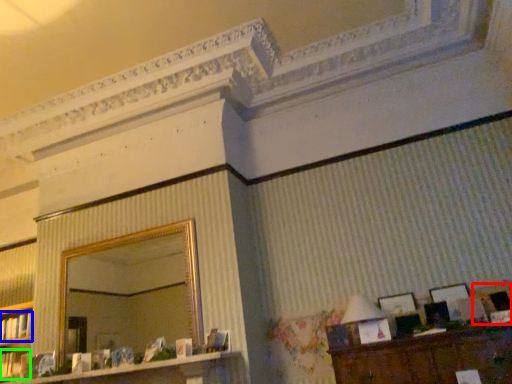
Question: Which object is the farthest from picture frame (highlighted by a red box)? Choose among these: book (highlighted by a blue box) or book (highlighted by a green box).

Choices:
 (A) book
 (B) book

Answer: (A)